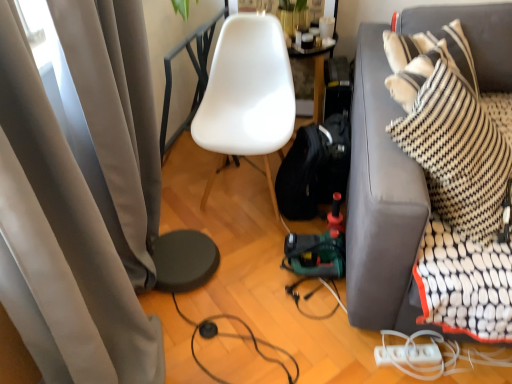
Question: Is white plastic power strip at lower right, which is counted as the 1th cable, starting from the right, oriented away from dark gray fabric couch at right?

Choices:
 (A) no
 (B) yes

Answer: (B)

Question: Can you confirm if white plastic power strip at lower right, which is the 2th cable from left to right, is taller than dark gray fabric couch at right?

Choices:
 (A) no
 (B) yes

Answer: (A)

Question: From a real-world perspective, is white plastic power strip at lower right, which is counted as the 1th cable, starting from the right, under dark gray fabric couch at right?

Choices:
 (A) no
 (B) yes

Answer: (B)

Question: Could you tell me if white plastic power strip at lower right, which is counted as the 1th cable, starting from the right, is turned towards dark gray fabric couch at right?

Choices:
 (A) no
 (B) yes

Answer: (B)

Question: Can you confirm if white plastic power strip at lower right, which is the 2th cable from left to right, is shorter than dark gray fabric couch at right?

Choices:
 (A) no
 (B) yes

Answer: (B)

Question: From a real-world perspective, is matte gray curtain at left above or below white matte chair at center?

Choices:
 (A) below
 (B) above

Answer: (B)

Question: Is matte gray curtain at left in front of or behind white matte chair at center in the image?

Choices:
 (A) front
 (B) behind

Answer: (A)

Question: In terms of height, does matte gray curtain at left look taller or shorter compared to white matte chair at center?

Choices:
 (A) short
 (B) tall

Answer: (B)

Question: From the image's perspective, relative to white matte chair at center, is matte gray curtain at left above or below?

Choices:
 (A) above
 (B) below

Answer: (B)

Question: Looking at the image, does white matte chair at center seem bigger or smaller compared to matte gray curtain at left?

Choices:
 (A) big
 (B) small

Answer: (B)

Question: Considering the positions of white matte chair at center and matte gray curtain at left in the image, is white matte chair at center wider or thinner than matte gray curtain at left?

Choices:
 (A) wide
 (B) thin

Answer: (A)

Question: Is white matte chair at center taller or shorter than matte gray curtain at left?

Choices:
 (A) tall
 (B) short

Answer: (B)

Question: Is point (257, 112) positioned closer to the camera than point (132, 327)?

Choices:
 (A) farther
 (B) closer

Answer: (A)

Question: In terms of height, does white matte chair at center look taller or shorter compared to black rubber cable at lower center, the second cable viewed from the right?

Choices:
 (A) tall
 (B) short

Answer: (A)

Question: From the image's perspective, is white matte chair at center positioned above or below black rubber cable at lower center, marked as the 1th cable in a left-to-right arrangement?

Choices:
 (A) below
 (B) above

Answer: (B)